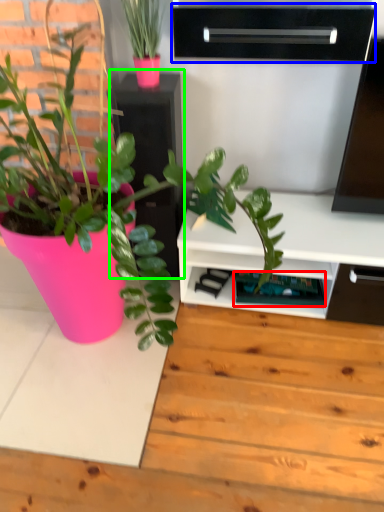
Question: Which is farther away from shelf (highlighted by a red box)? shelf (highlighted by a blue box) or file cabinet (highlighted by a green box)?

Choices:
 (A) shelf
 (B) file cabinet

Answer: (A)